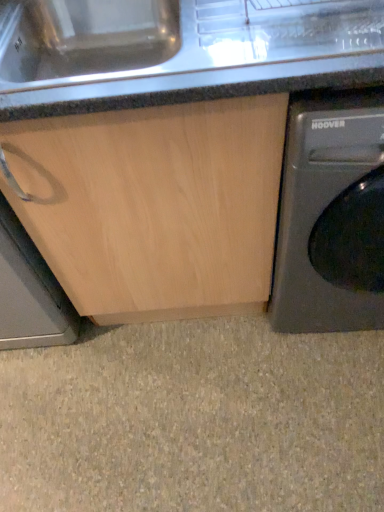
You are a GUI agent. You are given a task and a screenshot of the screen. Output one action in this format:
    pyautogui.click(x=<x>, y=<y>)
    Task: Click on the free space above beige wood cabinet at lower left (from a real-world perspective)
    The image size is (384, 512).
    Given the screenshot: What is the action you would take?
    pyautogui.click(x=185, y=402)